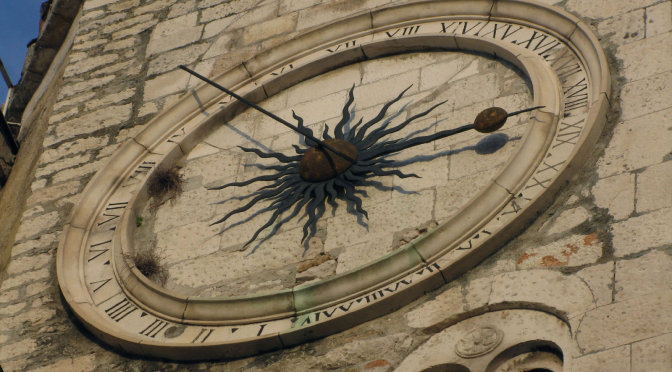
The width and height of the screenshot is (672, 372). What are the coordinates of `wall to right of clock` in the screenshot? It's located at (634, 65).